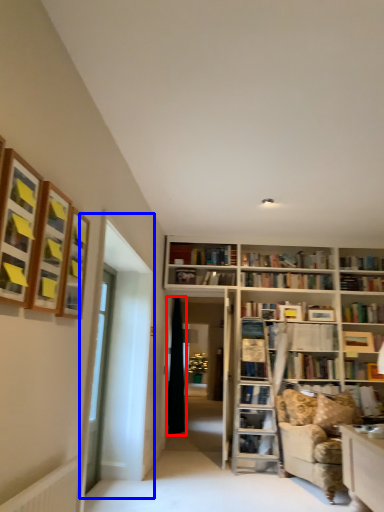
Question: Among these objects, which one is farthest to the camera, curtain (highlighted by a red box) or glass door (highlighted by a blue box)?

Choices:
 (A) curtain
 (B) glass door

Answer: (A)